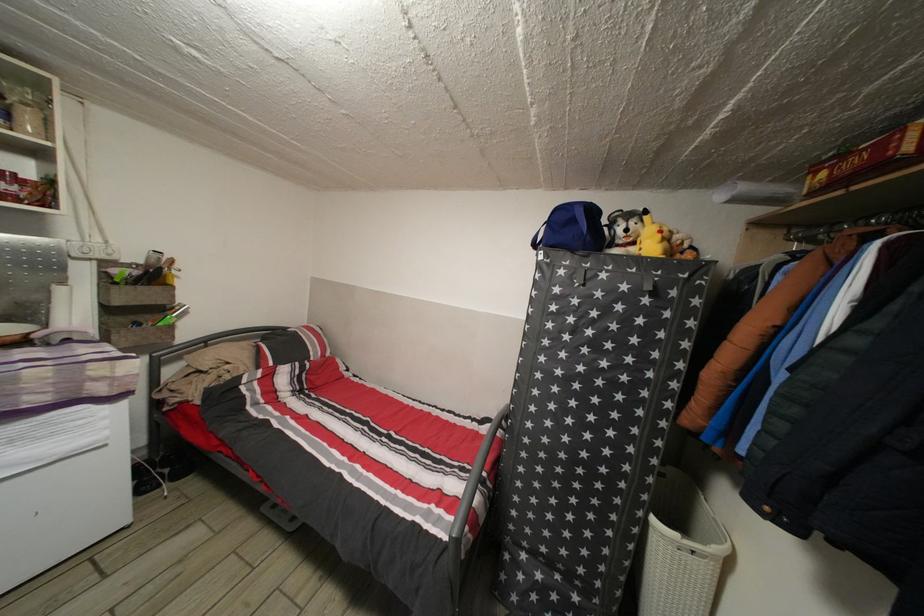
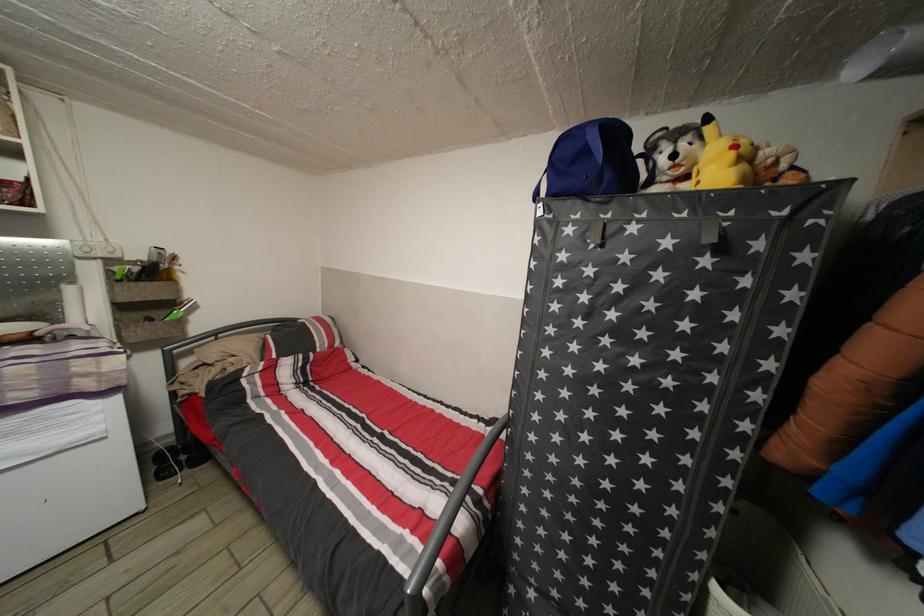
Find the pixel in the second image that matches point (163, 294) in the first image.

(164, 291)